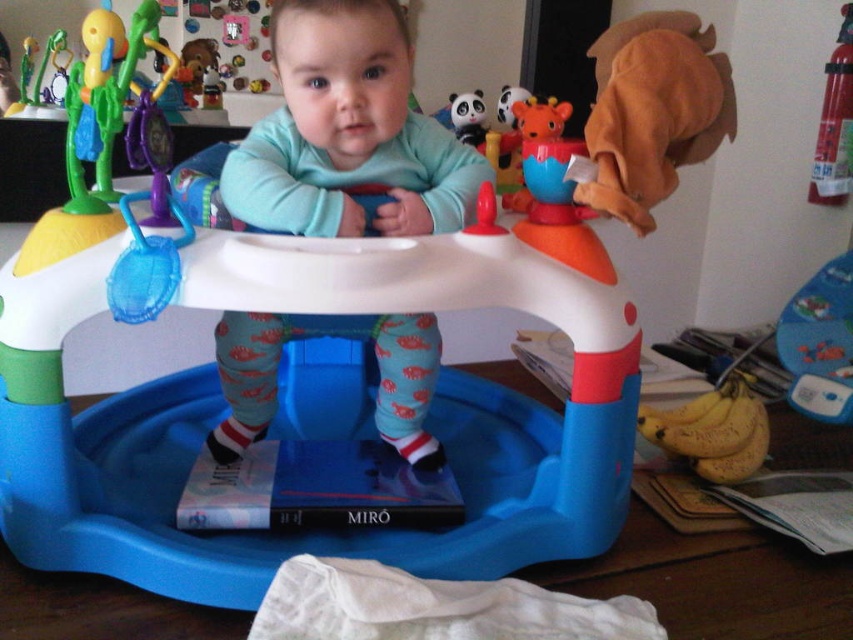
Is blue soft walker at center bigger than yellow matte bananas at lower right?

Correct, blue soft walker at center is larger in size than yellow matte bananas at lower right.

Who is positioned more to the right, blue soft walker at center or yellow matte bananas at lower right?

From the viewer's perspective, yellow matte bananas at lower right appears more on the right side.

Where is `blue soft walker at center`? The width and height of the screenshot is (853, 640). blue soft walker at center is located at coordinates (347, 132).

I want to click on blue soft walker at center, so click(347, 132).

Does blue plastic walker at center have a lesser width compared to yellow matte bananas at lower right?

Incorrect, blue plastic walker at center's width is not less than yellow matte bananas at lower right's.

This screenshot has width=853, height=640. What do you see at coordinates (316, 380) in the screenshot?
I see `blue plastic walker at center` at bounding box center [316, 380].

The image size is (853, 640). Identify the location of blue plastic walker at center. (316, 380).

Does blue plastic walker at center have a lesser height compared to blue soft walker at center?

No.

Describe the element at coordinates (316, 380) in the screenshot. I see `blue plastic walker at center` at that location.

Which is behind, point (283, 557) or point (409, 378)?

Positioned behind is point (409, 378).

I want to click on blue plastic walker at center, so click(316, 380).